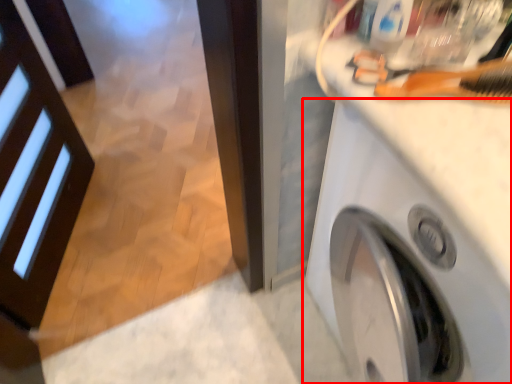
Question: Observing the image, what is the correct spatial positioning of washing machine (annotated by the red box) in reference to brush?

Choices:
 (A) right
 (B) left

Answer: (A)